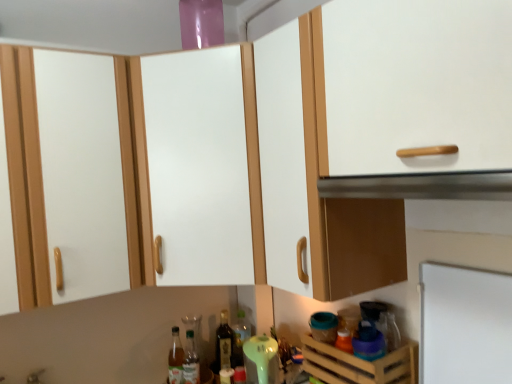
Question: Considering the positions of shiny dark glass bottle at center, which is the 2th bottle from left to right, and translucent glass bottle at center, acting as the third bottle starting from the left, in the image, is shiny dark glass bottle at center, which is the 2th bottle from left to right, wider or thinner than translucent glass bottle at center, acting as the third bottle starting from the left,?

Choices:
 (A) wide
 (B) thin

Answer: (A)

Question: From a real-world perspective, is shiny dark glass bottle at center, placed as the second bottle when sorted from right to left, physically located above or below translucent glass bottle at center, acting as the third bottle starting from the left?

Choices:
 (A) below
 (B) above

Answer: (A)

Question: Considering the real-world distances, which object is farthest from the white matte cabinet at center?

Choices:
 (A) shiny dark glass bottle at center, placed as the second bottle when sorted from right to left
 (B) wooden crate at lower right
 (C) clear glass bottle at lower center, which is the 1th bottle from left to right
 (D) metallic silver vent at upper center
 (E) translucent glass bottle at center, which is counted as the 1th bottle, starting from the right

Answer: (C)

Question: Estimate the real-world distances between objects in this image. Which object is farther from the white matte cabinet at center?

Choices:
 (A) wooden crate at lower right
 (B) clear glass bottle at lower center, placed as the third bottle when sorted from right to left
 (C) metallic silver vent at upper center
 (D) shiny dark glass bottle at center, which is the 2th bottle from left to right
 (E) translucent glass bottle at center, which is counted as the 1th bottle, starting from the right

Answer: (B)